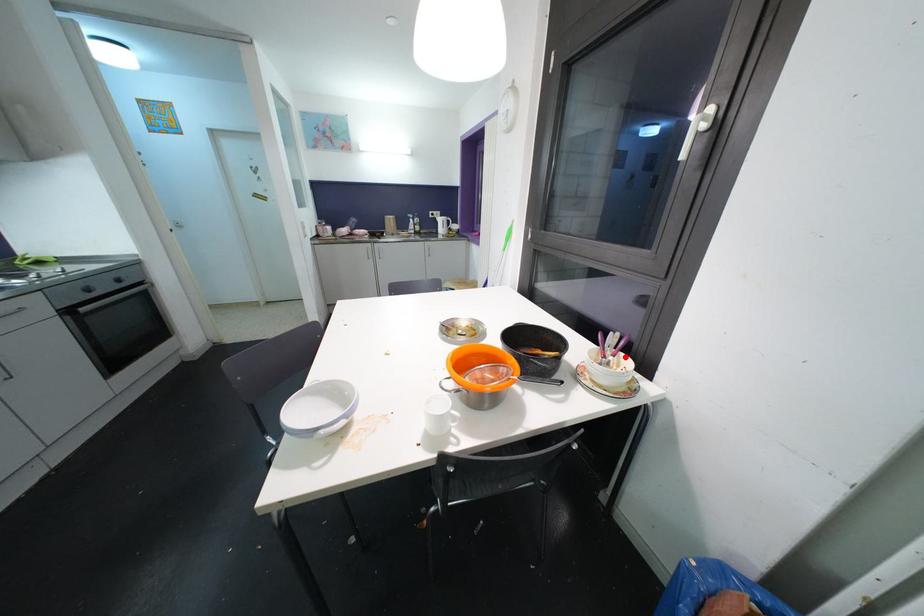
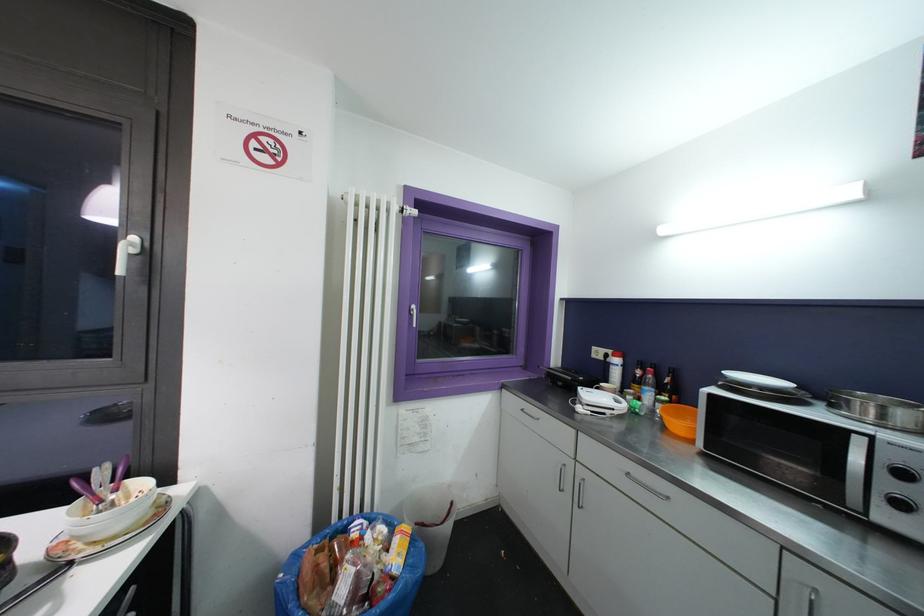
Where in the second image is the point corresponding to the highlighted location from the first image?

(131, 484)